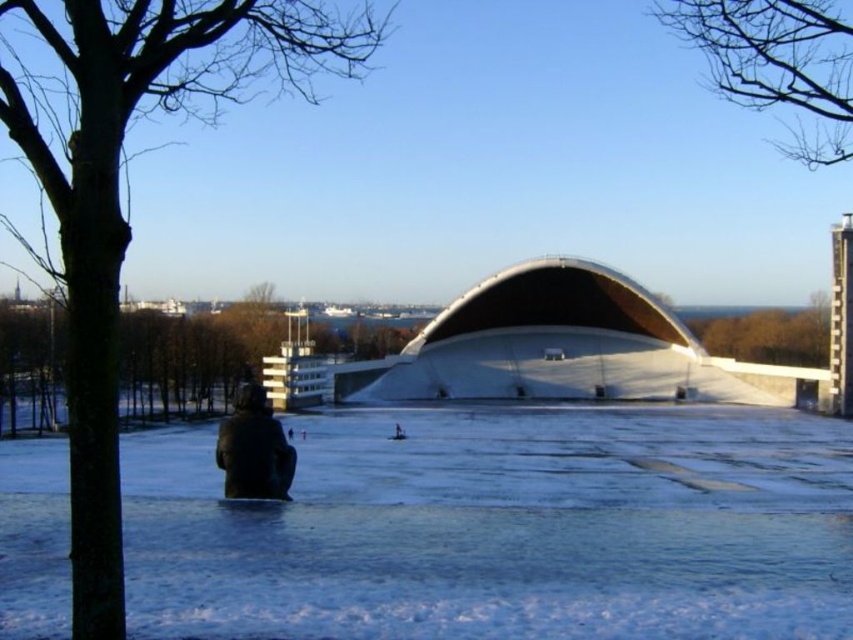
You are standing in the winter scene and want to walk towards the black matte jacket at lower center. Which direction should you move relative to the white matte snow at center?

Since the white matte snow at center is closer to the viewer than the black matte jacket at lower center, you should move away from the white matte snow at center to reach the black matte jacket at lower center.

You are standing in the winter scene and want to walk from the point closer to you to the point further away. Which path would you take between the two points, point [670,618] and point [229,488]?

The path from point [670,618] to point [229,488] would require moving away from the viewer since point [670,618] is closer to you than point [229,488].

You are standing in the winter scene and want to walk from the white matte snow at center to the green leafy tree at upper center. Which direction should you move to reach the tree?

To reach the green leafy tree at upper center from the white matte snow at center, you should move to the right since the snow is positioned to the left of the tree.